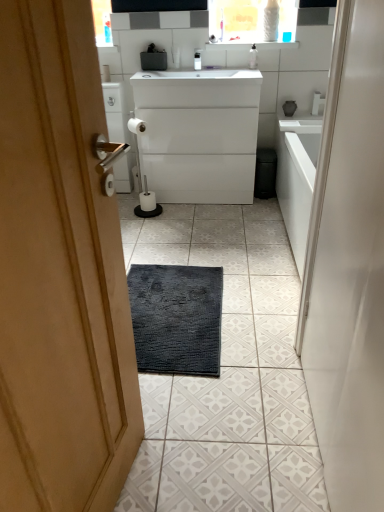
Question: Considering their positions, is white matte toilet paper at center, the 1th toilet paper when ordered from bottom to top, located in front of or behind white glossy cabinet at center?

Choices:
 (A) front
 (B) behind

Answer: (B)

Question: Based on their sizes in the image, would you say white matte toilet paper at center, the 1th toilet paper when ordered from bottom to top, is bigger or smaller than white glossy cabinet at center?

Choices:
 (A) big
 (B) small

Answer: (B)

Question: Considering the real-world distances, which object is farthest from the white glossy cabinet at center?

Choices:
 (A) white matte toilet paper at center, the 2th toilet paper from the top
 (B) transparent plastic bottle at upper center
 (C) white glossy medicine cabinet at upper center
 (D) white matte toilet paper at center, the 1th toilet paper from the left

Answer: (D)

Question: Estimate the real-world distances between objects in this image. Which object is closer to the white glossy medicine cabinet at upper center?

Choices:
 (A) white matte toilet paper at center, the second toilet paper from the bottom
 (B) transparent plastic bottle at upper center
 (C) white glossy cabinet at center
 (D) white matte toilet paper at center, which is counted as the 1th toilet paper, starting from the right

Answer: (B)